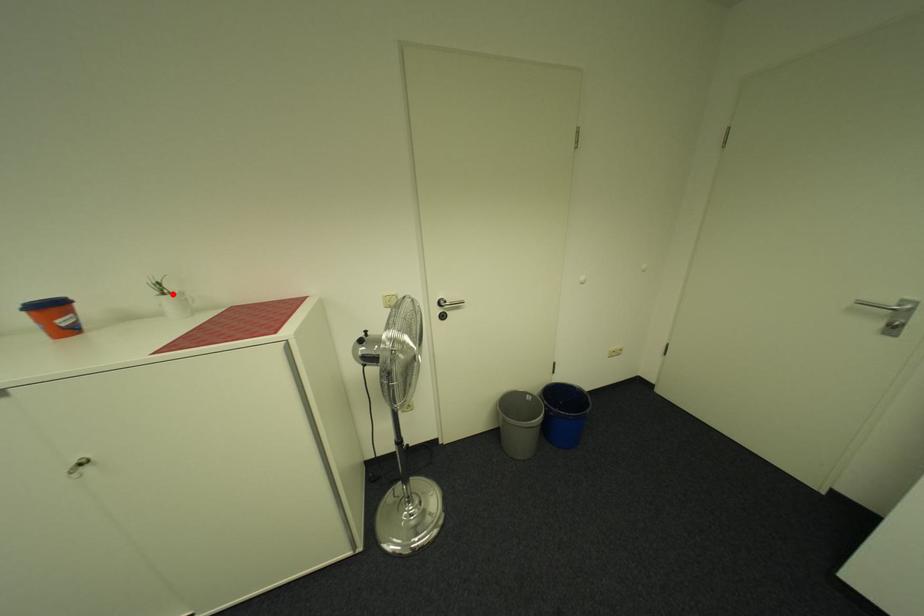
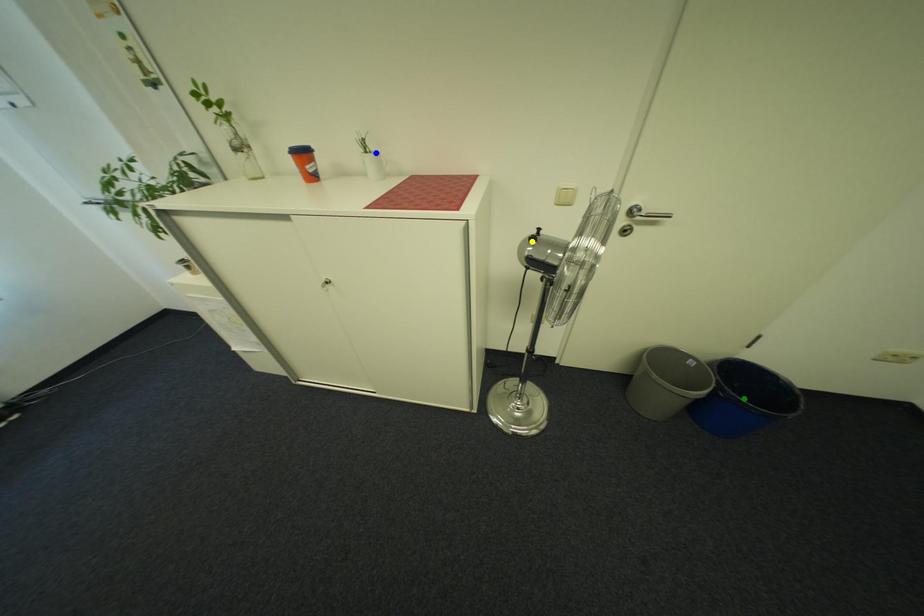
Question: I am providing you with two images of the same scene from different viewpoints. A red point is marked on the first image. You are given multiple points on the second image. Which point in image 2 is actually the same real-world point as the red point in image 1?

Choices:
 (A) green point
 (B) yellow point
 (C) blue point

Answer: (C)